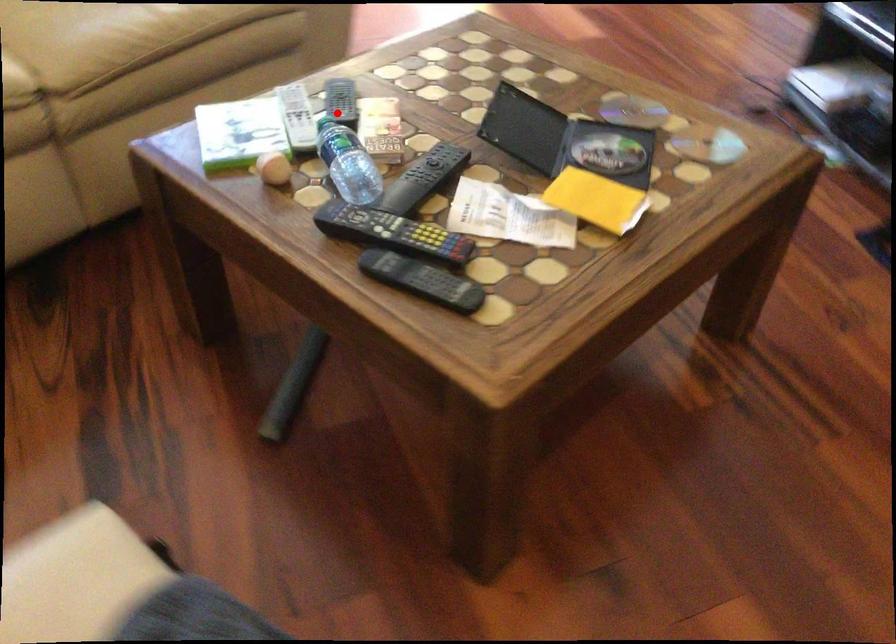
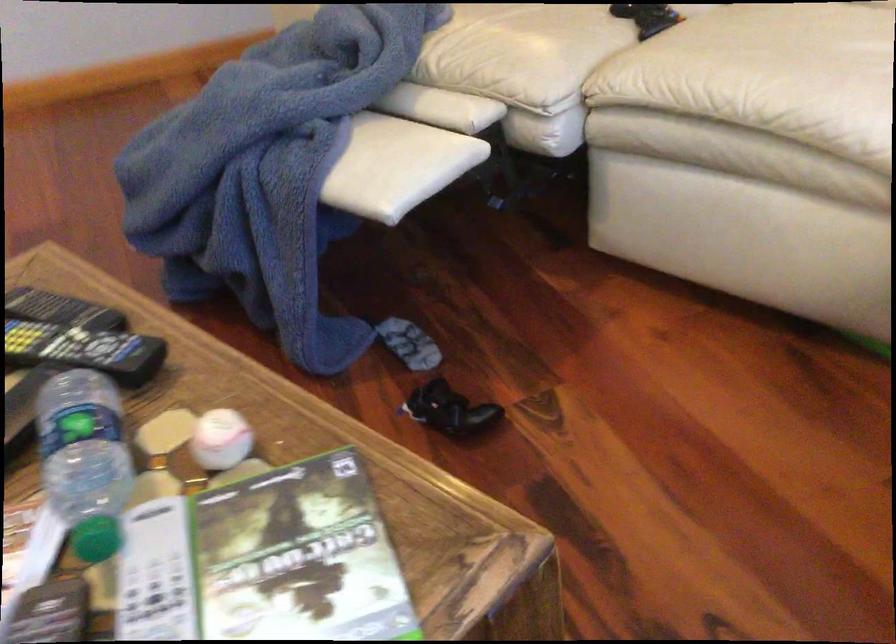
Question: I am providing you with two images of the same scene from different viewpoints. In image1, a red point is highlighted. Considering the same 3D point in image2, which of the following is correct?

Choices:
 (A) It is closer
 (B) It is farther

Answer: (A)